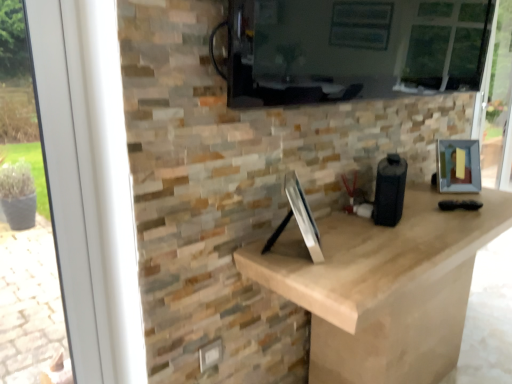
Image resolution: width=512 pixels, height=384 pixels. In order to click on free point above metallic silver picture frame at right (from a real-world perspective) in this screenshot , I will do `click(455, 138)`.